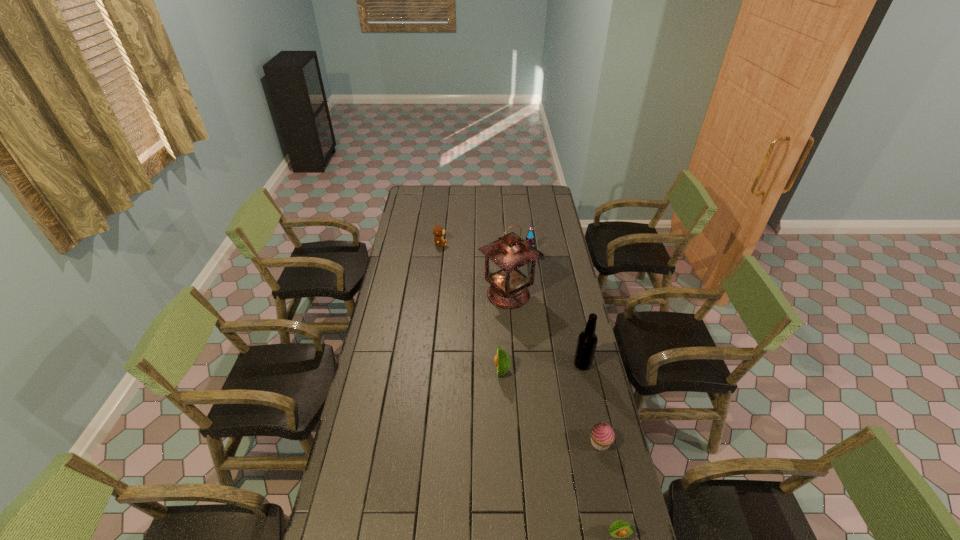
Find the location of a particular element. The width and height of the screenshot is (960, 540). the taller avocado is located at coordinates (502, 360).

The image size is (960, 540). I want to click on the farther avocado, so click(502, 360).

You are a GUI agent. You are given a task and a screenshot of the screen. Output one action in this format:
    pyautogui.click(x=<x>, y=<y>)
    Task: Click on the soda
    The height and width of the screenshot is (540, 960).
    Given the screenshot: What is the action you would take?
    530,238

This screenshot has height=540, width=960. What are the coordinates of `the leftmost object` in the screenshot? It's located at (438, 231).

Locate an element on the screen. the tallest object is located at coordinates (510, 261).

Identify the location of oil lamp. The width and height of the screenshot is (960, 540). [x=510, y=261].

The height and width of the screenshot is (540, 960). What are the coordinates of `cupcake` in the screenshot? It's located at [602, 435].

This screenshot has height=540, width=960. I want to click on beer bottle, so click(587, 341).

Find the location of a particular element. vacant space located 0.090m on the cut side of the left avocado is located at coordinates (471, 370).

The height and width of the screenshot is (540, 960). I want to click on free space located on the cut side of the left avocado, so click(396, 370).